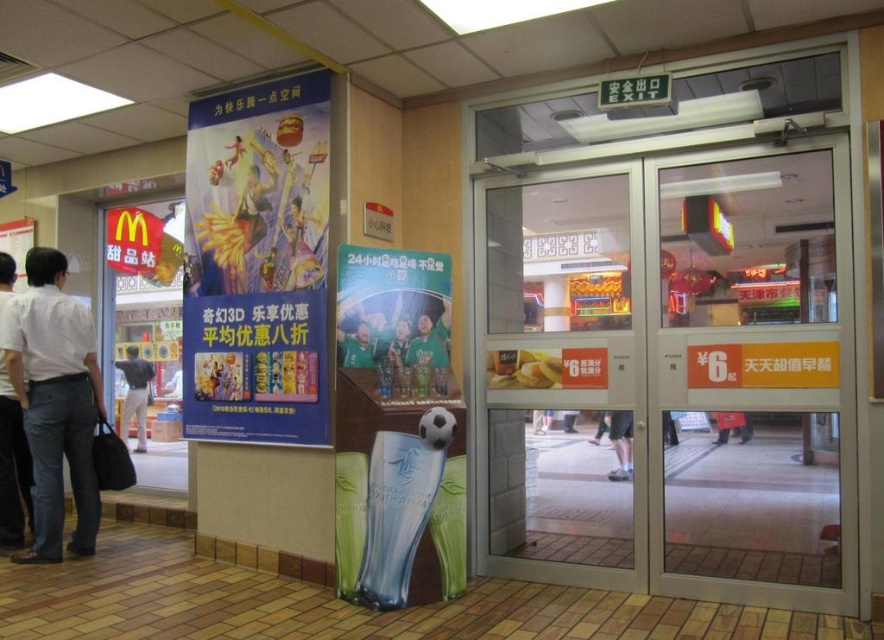
Based on the photo, you are a shopper who just entered the mall and see the white shirt at left and the red fabric bag at center. Which item is closer to the ground?

The white shirt at left is positioned under the red fabric bag at center, so it is closer to the ground.

You are standing in the shopping mall and want to determine which of the two points, point (x=43, y=536) or point (x=171, y=419), is closer to you. Based on the image, which point is nearer?

Point (x=43, y=536) is closer to the viewer than point (x=171, y=419).

You are a customer in the shopping mall and you see the light gray pants at left and the dark blue shirt at left. Which one is higher up on the wall?

The light gray pants at left is located above the dark blue shirt at left, so the light gray pants at left is higher up on the wall.